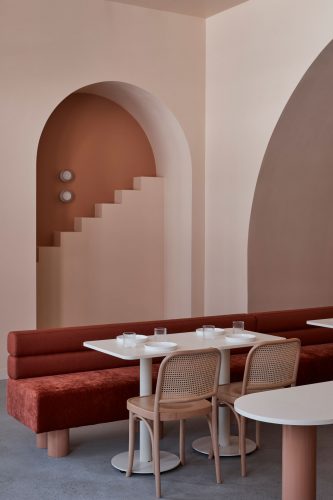
Locate an element on the screen. seating is located at coordinates (69, 387).